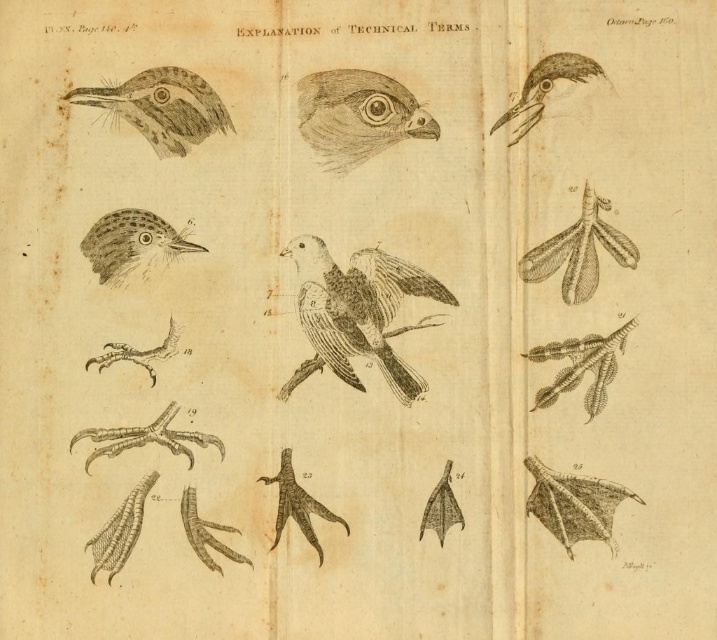
Question: Does etched paper bird head at center appear on the left side of speckled feathered bird head at center-left?

Choices:
 (A) yes
 (B) no

Answer: (B)

Question: Based on their relative distances, which object is farther from the speckled feathered bird head at center-left?

Choices:
 (A) etched paper bird at upper left
 (B) brown speckled bird at center
 (C) etched paper bird head at center

Answer: (C)

Question: Considering the real-world distances, which object is closest to the brown speckled bird at center?

Choices:
 (A) etched paper bird at upper left
 (B) matte black bird head at upper right

Answer: (A)

Question: Estimate the real-world distances between objects in this image. Which object is farther from the brown speckled bird at center?

Choices:
 (A) speckled feathered bird head at center-left
 (B) etched paper bird head at center
 (C) matte black bird head at upper right
 (D) etched paper bird at upper left

Answer: (C)

Question: From the image, what is the correct spatial relationship of brown speckled bird at center in relation to speckled feathered bird head at center-left?

Choices:
 (A) below
 (B) above

Answer: (A)

Question: Can you confirm if brown speckled bird at center is wider than etched paper bird head at center?

Choices:
 (A) no
 (B) yes

Answer: (B)